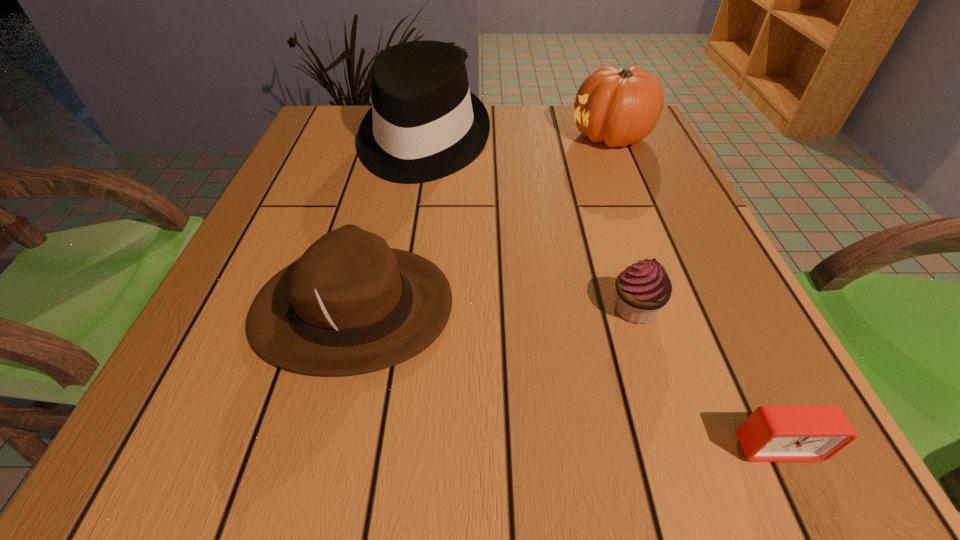
Find the location of a particular element. Image resolution: width=960 pixels, height=540 pixels. vacant area situated on the feather side of the nearer fedora is located at coordinates (579, 307).

Identify the location of free space located 0.210m on the left of the cupcake. (476, 309).

Locate an element on the screen. fedora at the far edge is located at coordinates (424, 124).

This screenshot has width=960, height=540. Find the location of `pumpkin that is at the far edge`. pumpkin that is at the far edge is located at coordinates (621, 106).

Where is `object that is at the near edge`? object that is at the near edge is located at coordinates click(x=772, y=433).

Find the location of a particular element. pumpkin located in the right edge section of the desktop is located at coordinates (621, 106).

Locate an element on the screen. cupcake that is at the right edge is located at coordinates (644, 288).

Identify the location of alarm clock that is at the right edge. (772, 433).

Identify the location of object that is at the far left corner. Image resolution: width=960 pixels, height=540 pixels. (424, 124).

Where is `object that is at the far right corner`? The height and width of the screenshot is (540, 960). object that is at the far right corner is located at coordinates (621, 106).